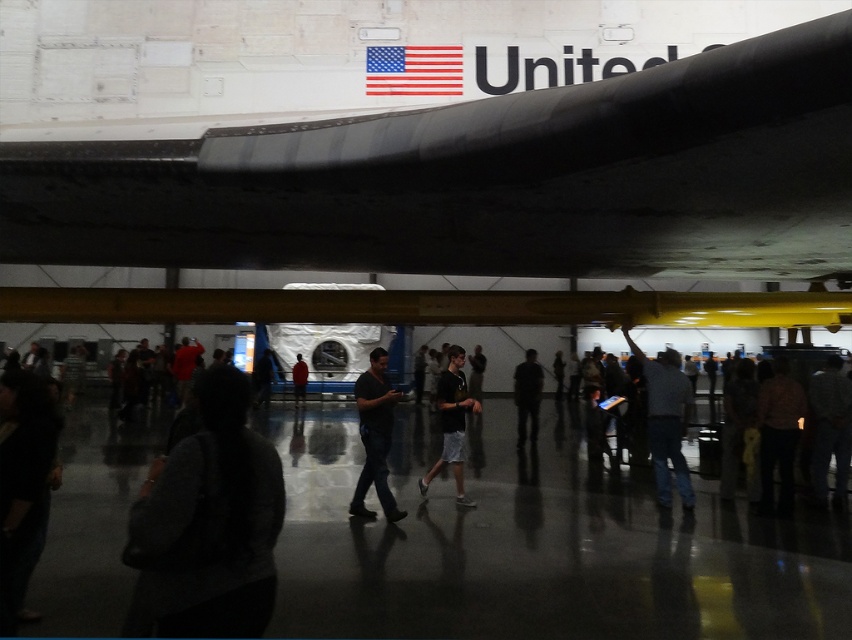
You are an interior designer planning to install a new display case in the museum. The display case must accommodate both the matte black airplane at center and the red fabric flag at upper center. Which object requires a wider display case based on their dimensions?

The matte black airplane at center requires a wider display case because its width surpasses that of the red fabric flag at upper center.

You are a visitor at the museum and want to take a photo of the matte black airplane at center and the red fabric flag at upper center. Which object should you focus on first if you want to capture both in a single frame without moving your camera?

The matte black airplane at center is positioned on the right side of the red fabric flag at upper center, so you should focus on the red fabric flag at upper center first to ensure both are in frame.